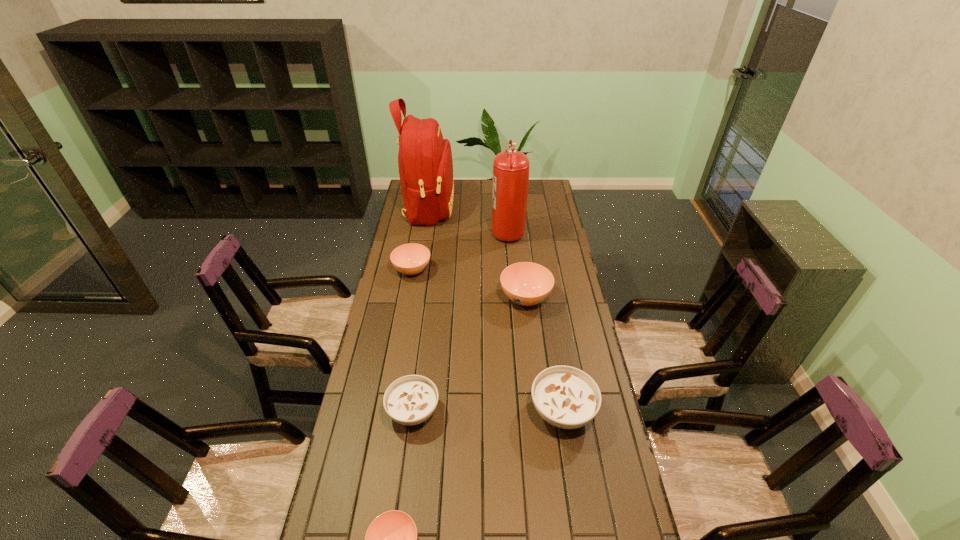
Find the location of `free point between the bigger white soup bowl and the left white soup bowl`. free point between the bigger white soup bowl and the left white soup bowl is located at coordinates (488, 411).

The height and width of the screenshot is (540, 960). Identify the location of unoccupied area between the red fire extinguisher and the bigger white soup bowl. (535, 321).

Image resolution: width=960 pixels, height=540 pixels. In order to click on unoccupied area between the pink backpack and the second smallest peach soup bowl in this screenshot , I will do `click(420, 239)`.

This screenshot has width=960, height=540. Identify the location of object that is the closest to the backpack. (510, 182).

Locate an element on the screen. This screenshot has width=960, height=540. the sixth closest object to the nearest object is located at coordinates (425, 163).

Identify which soup bowl is the fourth nearest to the second biggest peach soup bowl. Please provide its 2D coordinates. Your answer should be formatted as a tuple, i.e. [(x, y)], where the tuple contains the x and y coordinates of a point satisfying the conditions above.

[(391, 539)]

Identify which soup bowl is the closest to the red fire extinguisher. Please provide its 2D coordinates. Your answer should be formatted as a tuple, i.e. [(x, y)], where the tuple contains the x and y coordinates of a point satisfying the conditions above.

[(525, 283)]

Identify which peach soup bowl is the nearest to the pink backpack. Please provide its 2D coordinates. Your answer should be formatted as a tuple, i.e. [(x, y)], where the tuple contains the x and y coordinates of a point satisfying the conditions above.

[(409, 259)]

The image size is (960, 540). Find the location of `peach soup bowl that is the second closest to the smaller white soup bowl`. peach soup bowl that is the second closest to the smaller white soup bowl is located at coordinates (525, 283).

At what (x,y) coordinates should I click in order to perform the action: click on white soup bowl that is the second closest one to the pink backpack. Please return your answer as a coordinate pair (x, y). Looking at the image, I should click on (566, 397).